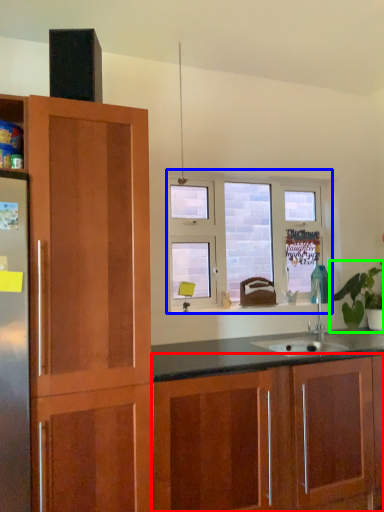
Question: Based on their relative distances, which object is farther from cabinetry (highlighted by a red box)? Choose from window (highlighted by a blue box) and houseplant (highlighted by a green box).

Choices:
 (A) window
 (B) houseplant

Answer: (A)